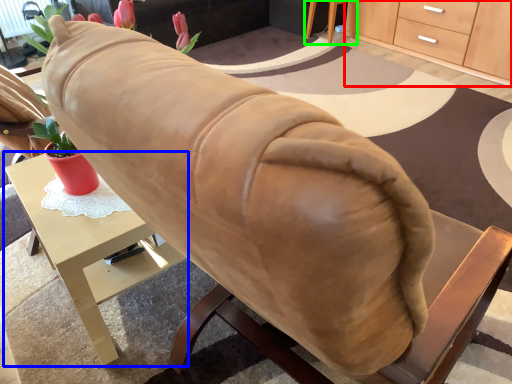
Question: Which object is the closest to the cabinetry (highlighted by a red box)? Choose among these: desk (highlighted by a blue box) or table (highlighted by a green box).

Choices:
 (A) desk
 (B) table

Answer: (B)